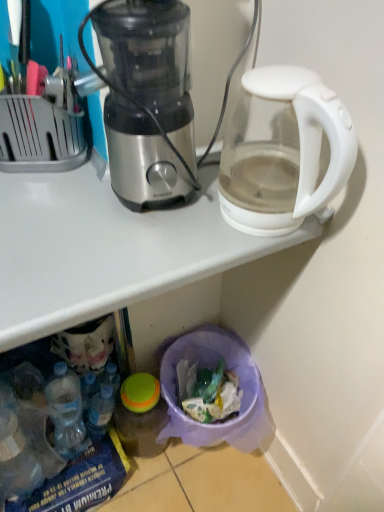
Identify the location of vacant area situated below stainless steel blender at center (from a real-world perspective). The width and height of the screenshot is (384, 512). (137, 206).